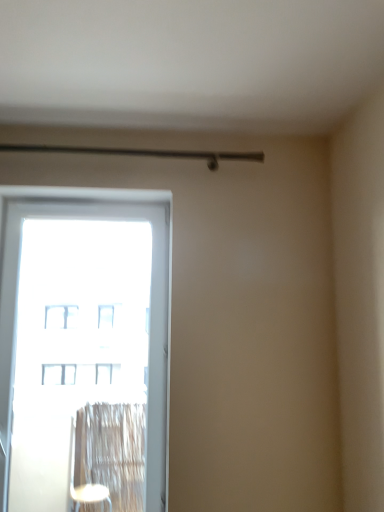
Where is `transparent glass window at left`? This screenshot has height=512, width=384. transparent glass window at left is located at coordinates (84, 353).

The image size is (384, 512). Describe the element at coordinates (84, 353) in the screenshot. I see `transparent glass window at left` at that location.

Locate an element on the screen. transparent glass window at left is located at coordinates tap(84, 353).